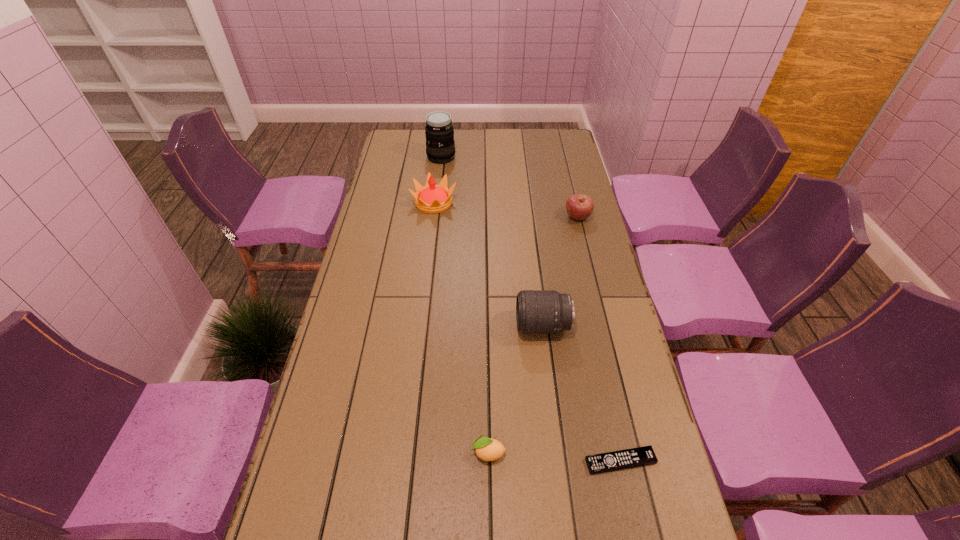
Select which object appears as the fifth closest to the fourth tallest object. Please provide its 2D coordinates. Your answer should be formatted as a tuple, i.e. [(x, y)], where the tuple contains the x and y coordinates of a point satisfying the conditions above.

[(487, 449)]

Identify which object is located as the fifth nearest to the third nearest object. Please provide its 2D coordinates. Your answer should be formatted as a tuple, i.e. [(x, y)], where the tuple contains the x and y coordinates of a point satisfying the conditions above.

[(440, 147)]

Identify the location of free spot that satisfies the following two spatial constraints: 1. on the surface of the right telephoto lens; 2. on the right side of the shortest object. The height and width of the screenshot is (540, 960). (560, 461).